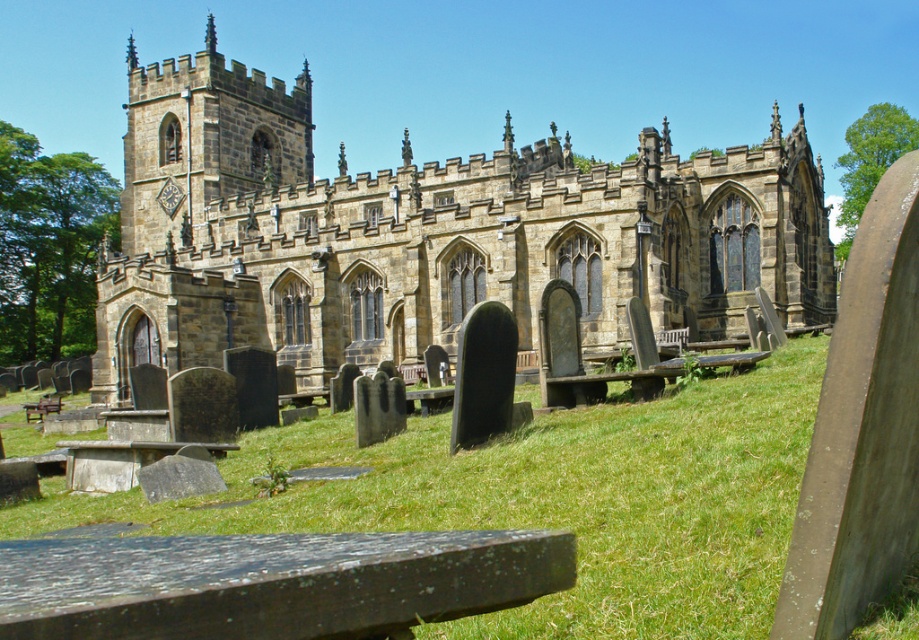
Looking at this image, you are standing at the entrance of the historic churchyard and want to locate two specific points marked in the image. The first point is at coordinates point (511, 225) and the second is at point (557, 490). Which of these two points is closer to the church in the background?

Point (511, 225) is behind point (557, 490), so it is closer to the church in the background.

You are a landscape architect planning to maintain the green grass at center. Considering the size of the brown stone church at center, will you need to adjust the maintenance equipment to accommodate the space between them?

The brown stone church at center is larger in size than green grass at center, so you will need to adjust the maintenance equipment to ensure it can maneuver around the church while maintaining the green grass at center.

You are a landscape architect planning to redesign the churchyard. You need to know the relative sizes of the brown stone church at center and the green grass at center. Which one is wider?

The brown stone church at center is wider than the green grass at center according to the description.